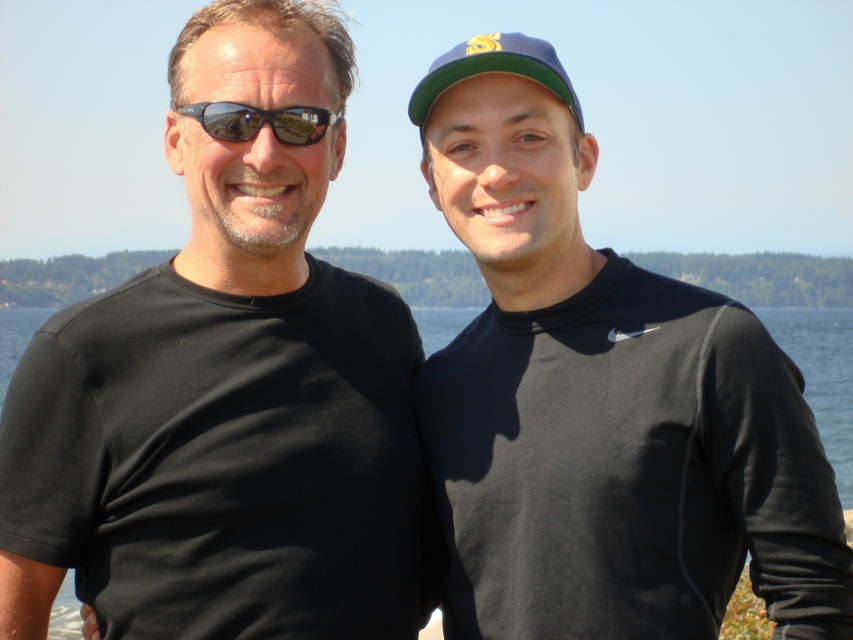
Consider the image. You are a photographer trying to capture a clear shot of both the green fabric baseball cap at upper center and the matte black goggles at left. Based on their positions, which object should you focus on first to ensure both are in focus?

You should focus on the green fabric baseball cap at upper center first because the matte black goggles at left is behind it, ensuring both will be in focus if the cap is sharply focused.

You are a photographer trying to capture a clear shot of the green fabric baseball cap at upper center. The cap is located at coordinates point 0.109, 0.579. Given that the camera frame has a width of 1 unit, can you determine if the cap will fit entirely within the frame?

The green fabric baseball cap at upper center is located at point (x=492, y=68). Since the camera frame has a width of 1 unit, the cap will fit entirely within the frame as its position is within the frame boundaries.